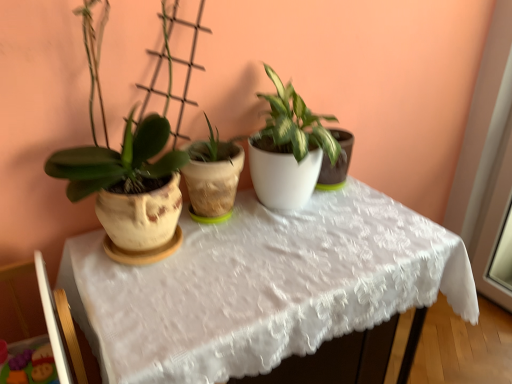
At what (x,y) coordinates should I click in order to perform the action: click on blank space above white lace tablecloth at center (from a real-world perspective). Please return your answer as a coordinate pair (x, y). This screenshot has height=384, width=512. Looking at the image, I should click on (272, 237).